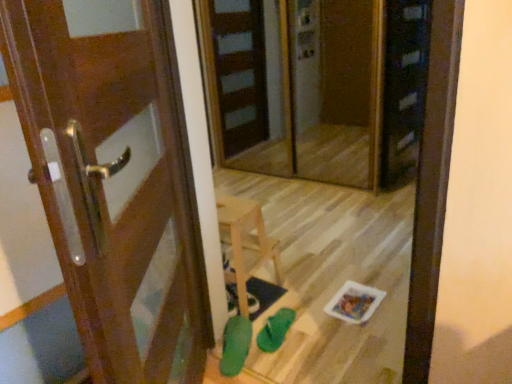
Locate an element on the screen. The height and width of the screenshot is (384, 512). free space to the back side of green rubber shoe at lower center, which is the 1th shoe from right to left is located at coordinates (280, 301).